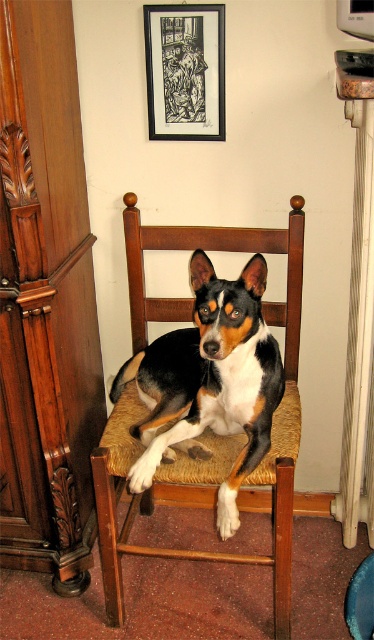
Does black and white fur dog at center appear under black paper picture frame at upper center?

Indeed, black and white fur dog at center is positioned under black paper picture frame at upper center.

Is black and white fur dog at center smaller than black paper picture frame at upper center?

Incorrect, black and white fur dog at center is not smaller in size than black paper picture frame at upper center.

Does point (253, 372) lie behind point (181, 102)?

No, (253, 372) is in front of (181, 102).

What are the coordinates of `black and white fur dog at center` in the screenshot? It's located at (213, 380).

Find the location of a particular element. brushed wood cabinet at left is located at coordinates (46, 301).

Is point (54, 307) closer to camera compared to point (225, 417)?

No, (54, 307) is further to viewer.

Find the location of a particular element. brushed wood cabinet at left is located at coordinates (46, 301).

Is brushed wood cabinet at left shorter than black paper picture frame at upper center?

Incorrect, brushed wood cabinet at left's height does not fall short of black paper picture frame at upper center's.

Does brushed wood cabinet at left appear on the left side of black paper picture frame at upper center?

Yes, brushed wood cabinet at left is to the left of black paper picture frame at upper center.

Does point (34, 548) come behind point (188, 67)?

Yes, it is.

The image size is (374, 640). What are the coordinates of `brushed wood cabinet at left` in the screenshot? It's located at (46, 301).